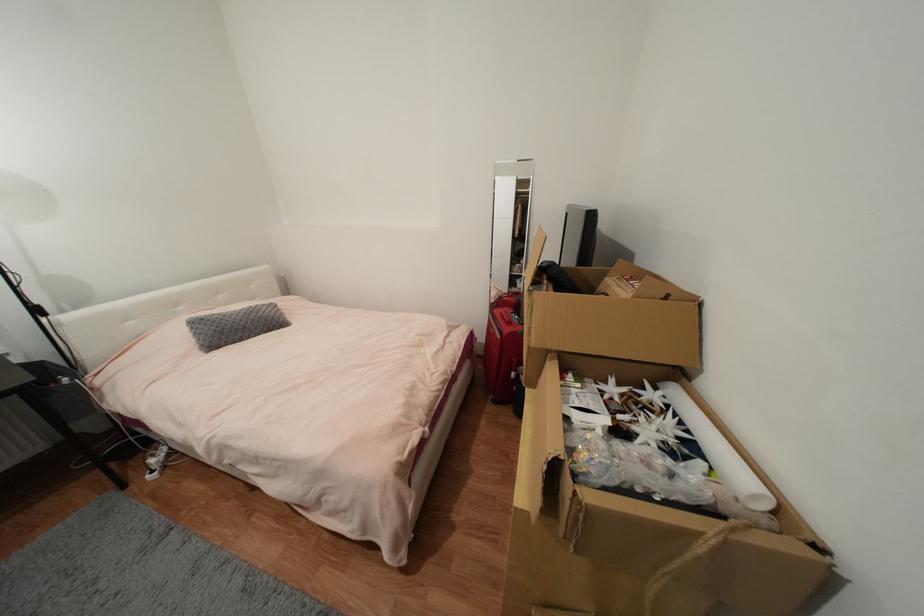
Where would you pull the red suitcase handle? Please return your answer as a coordinate pair (x, y).

(513, 370)